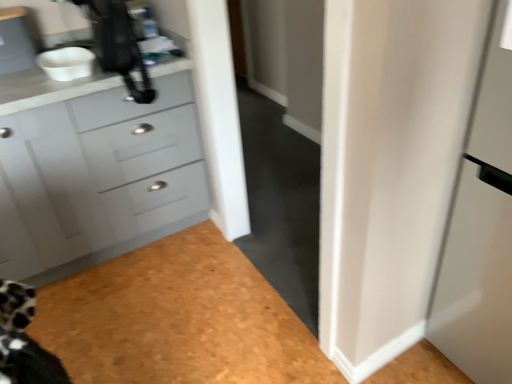
Question: Is white matte bowl at upper left in front of matte gray cabinet at left?

Choices:
 (A) yes
 (B) no

Answer: (B)

Question: Can you confirm if white matte bowl at upper left is wider than matte gray cabinet at left?

Choices:
 (A) yes
 (B) no

Answer: (B)

Question: From the image's perspective, is white matte bowl at upper left beneath matte gray cabinet at left?

Choices:
 (A) no
 (B) yes

Answer: (A)

Question: Considering the relative sizes of white matte bowl at upper left and matte gray cabinet at left in the image provided, is white matte bowl at upper left bigger than matte gray cabinet at left?

Choices:
 (A) yes
 (B) no

Answer: (B)

Question: Can you see white matte bowl at upper left touching matte gray cabinet at left?

Choices:
 (A) yes
 (B) no

Answer: (B)

Question: Is point (135, 39) positioned closer to the camera than point (15, 59)?

Choices:
 (A) farther
 (B) closer

Answer: (B)

Question: From the image's perspective, relative to matte gray cabinet at upper left, is black plastic coffee machine at upper left above or below?

Choices:
 (A) above
 (B) below

Answer: (B)

Question: From a real-world perspective, is black plastic coffee machine at upper left physically located above or below matte gray cabinet at upper left?

Choices:
 (A) below
 (B) above

Answer: (A)

Question: Considering the positions of black plastic coffee machine at upper left and matte gray cabinet at upper left in the image, is black plastic coffee machine at upper left bigger or smaller than matte gray cabinet at upper left?

Choices:
 (A) big
 (B) small

Answer: (A)

Question: From the image's perspective, is matte gray cabinet at upper left positioned above or below matte gray cabinet at left?

Choices:
 (A) below
 (B) above

Answer: (B)

Question: Is matte gray cabinet at upper left in front of or behind matte gray cabinet at left in the image?

Choices:
 (A) behind
 (B) front

Answer: (A)

Question: Is point (3, 28) closer or farther from the camera than point (151, 210)?

Choices:
 (A) closer
 (B) farther

Answer: (A)

Question: Would you say matte gray cabinet at upper left is to the left or to the right of matte gray cabinet at left in the picture?

Choices:
 (A) right
 (B) left

Answer: (B)

Question: Considering the positions of matte gray cabinet at left and white matte bowl at upper left in the image, is matte gray cabinet at left taller or shorter than white matte bowl at upper left?

Choices:
 (A) tall
 (B) short

Answer: (A)

Question: Does point (23, 160) appear closer or farther from the camera than point (87, 56)?

Choices:
 (A) closer
 (B) farther

Answer: (A)